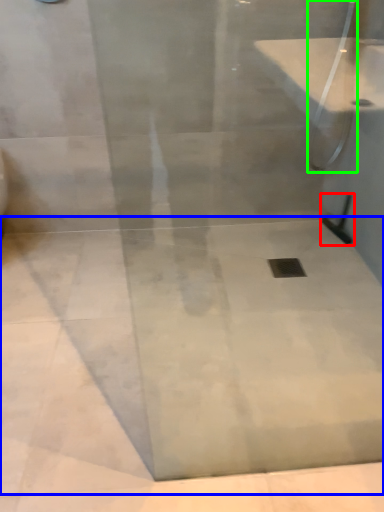
Question: Based on their relative distances, which object is nearer to shower (highlighted by a red box)? Choose from concrete (highlighted by a blue box) and shower (highlighted by a green box).

Choices:
 (A) concrete
 (B) shower

Answer: (B)